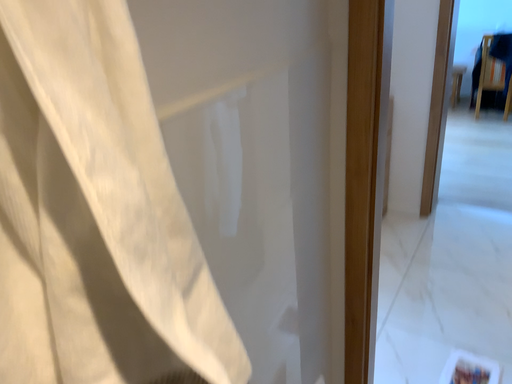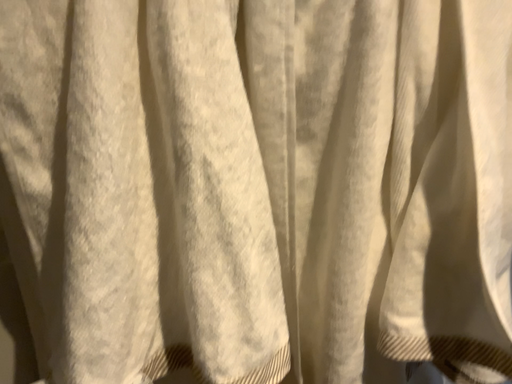
Question: How did the camera likely rotate when shooting the video?

Choices:
 (A) rotated right
 (B) rotated left

Answer: (B)